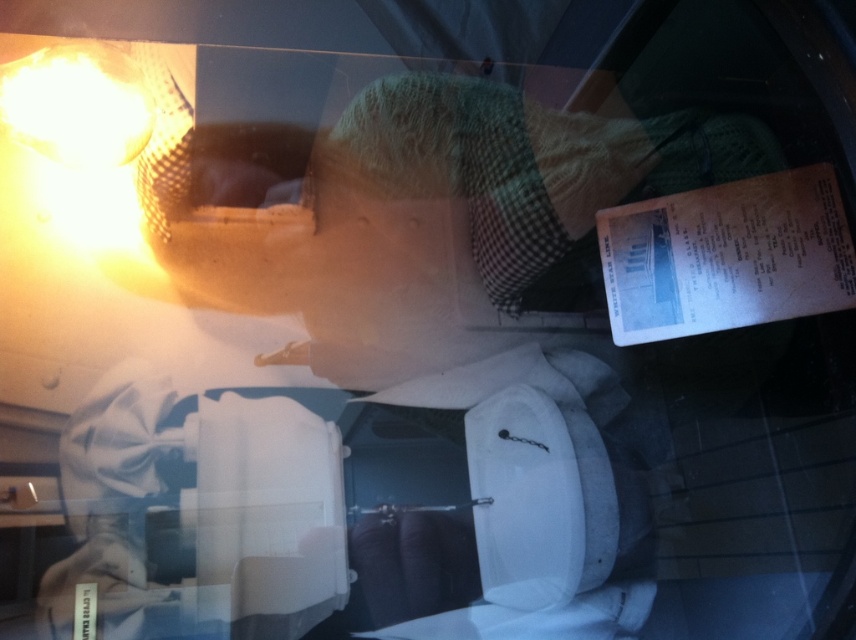
Between green knitted hat at upper center and matte yellow mesh lamp at upper left, which one is positioned lower?

Positioned lower is green knitted hat at upper center.

Is green knitted hat at upper center below matte yellow mesh lamp at upper left?

Yes.

The height and width of the screenshot is (640, 856). I want to click on green knitted hat at upper center, so click(x=437, y=214).